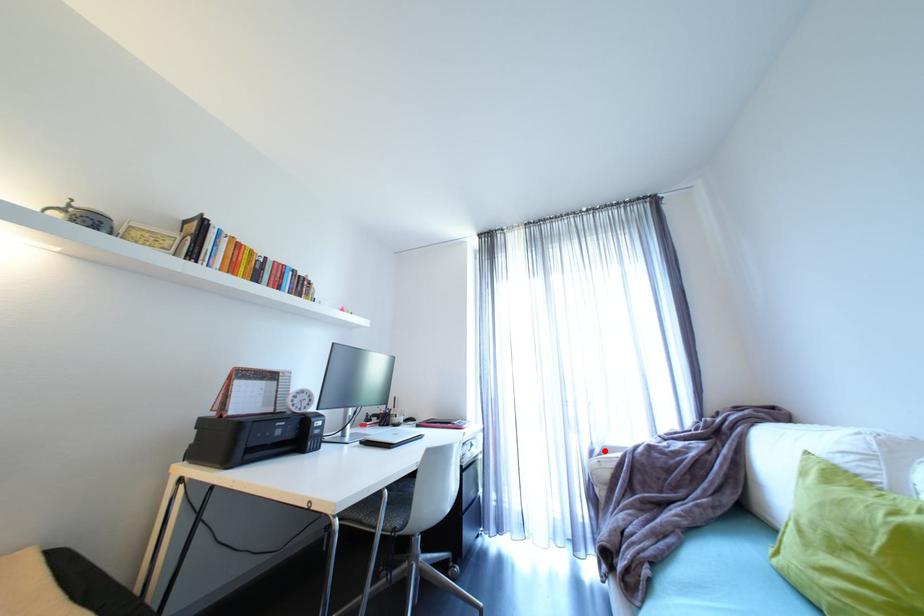
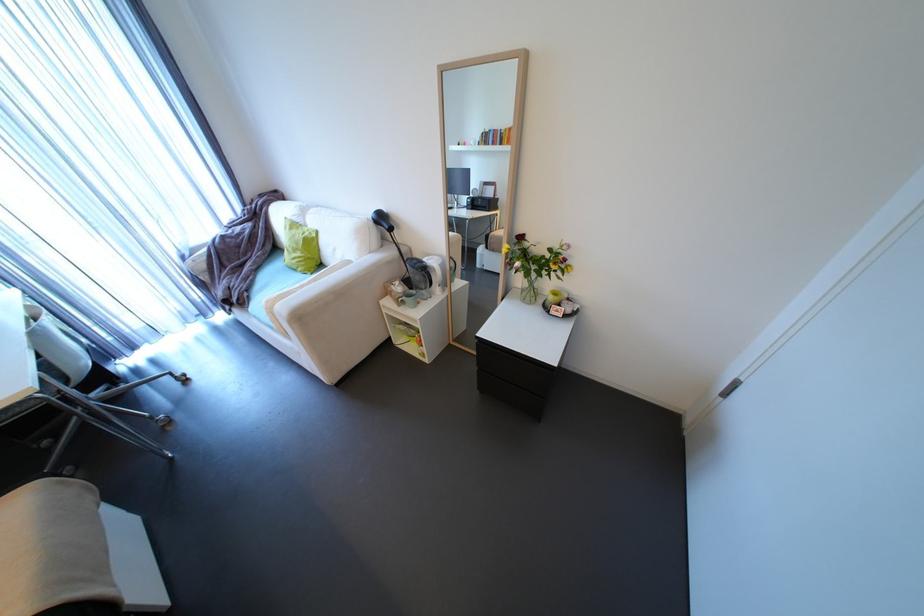
Question: I am providing you with two images of the same scene from different viewpoints. In image1, a red point is highlighted. Considering the same 3D point in image2, which of the following is correct?

Choices:
 (A) It is closer
 (B) It is farther

Answer: (A)